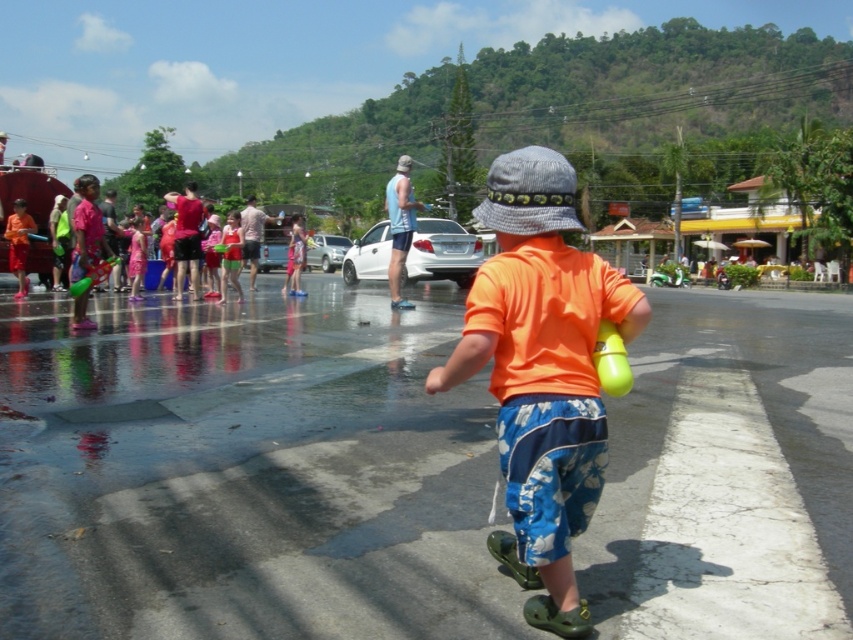
Question: Is orange matte shirt at center thinner than translucent yellow balloon at center?

Choices:
 (A) no
 (B) yes

Answer: (A)

Question: Which of the following is the farthest from the observer?

Choices:
 (A) blue fabric tank top at center
 (B) orange matte shirt at center
 (C) translucent yellow balloon at center

Answer: (A)

Question: Which point appears closest to the camera in this image?

Choices:
 (A) (560, 536)
 (B) (606, 320)

Answer: (A)

Question: Is the position of orange matte shirt at center less distant than that of translucent yellow balloon at center?

Choices:
 (A) yes
 (B) no

Answer: (B)

Question: Which object is the farthest from the blue fabric tank top at center?

Choices:
 (A) translucent yellow balloon at center
 (B) orange matte shirt at center

Answer: (B)

Question: Where is orange matte shirt at center located in relation to blue fabric tank top at center in the image?

Choices:
 (A) above
 (B) below

Answer: (B)